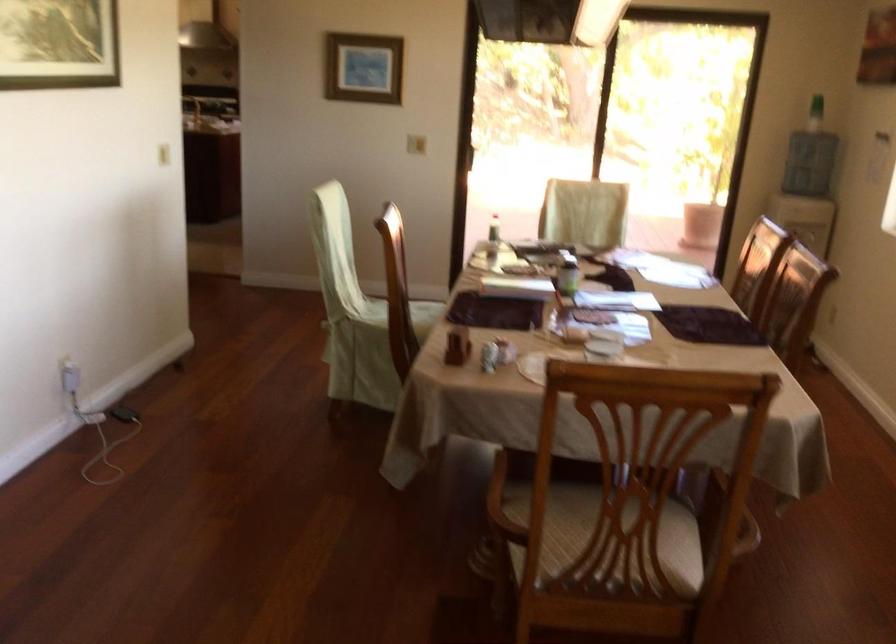
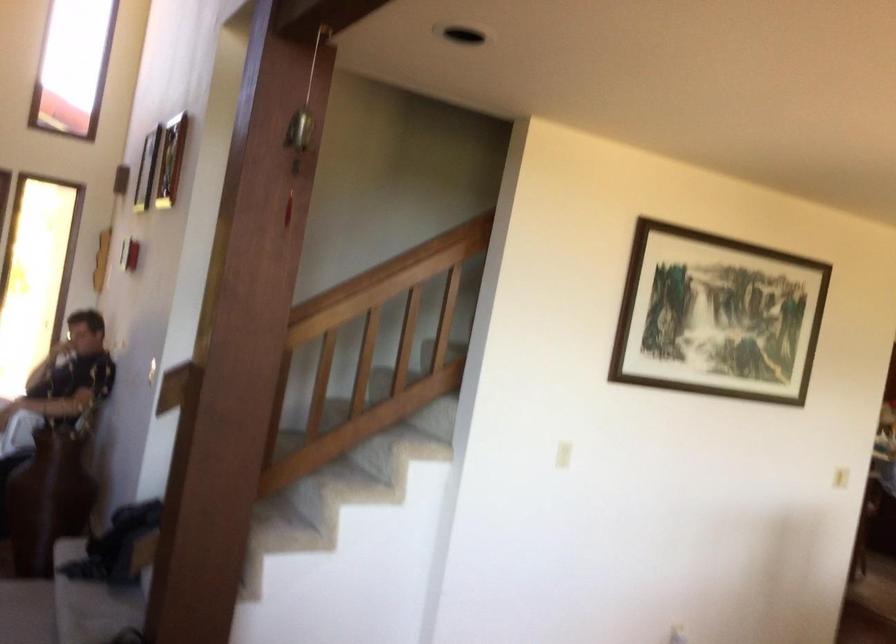
Question: The camera is either moving clockwise (left) or counter-clockwise (right) around the object. The first image is from the beginning of the video and the second image is from the end. Is the camera moving left or right when shooting the video?

Choices:
 (A) Left
 (B) Right

Answer: (B)